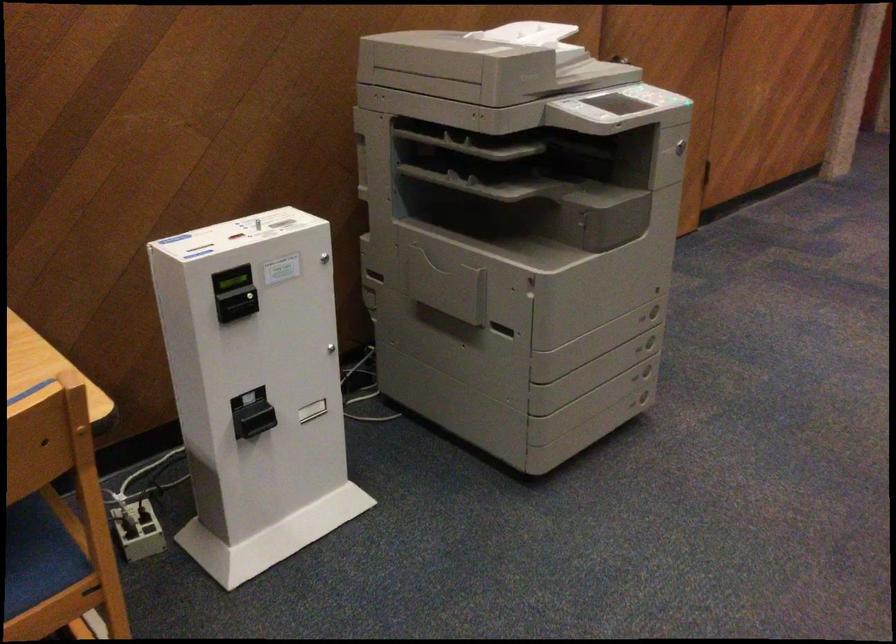
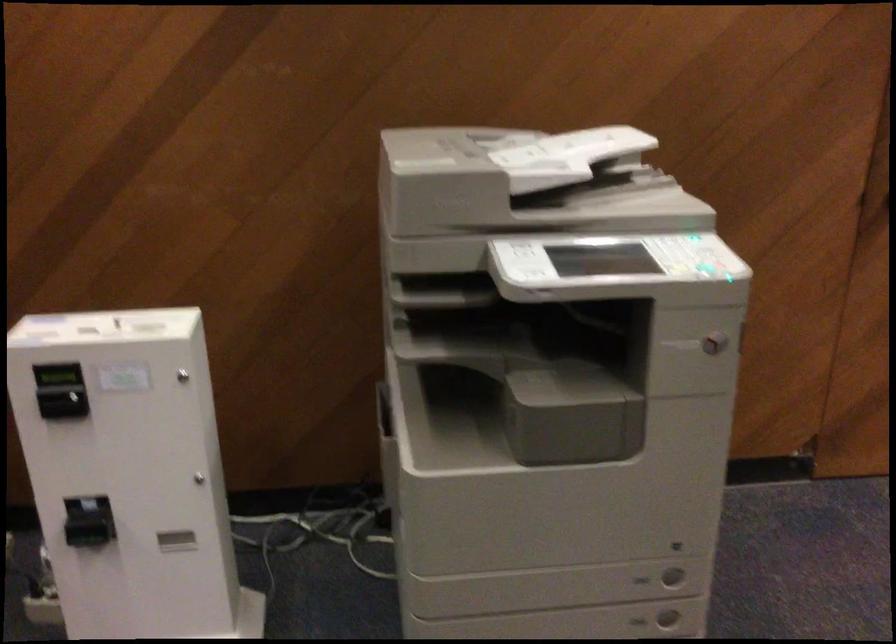
Question: I am providing you with two images of the same scene from different viewpoints. After the viewpoint changes to image2, which objects are now occluded?

Choices:
 (A) printer drawer handle
 (B) card reader slot
 (C) printer key lock
 (D) none of these

Answer: (D)